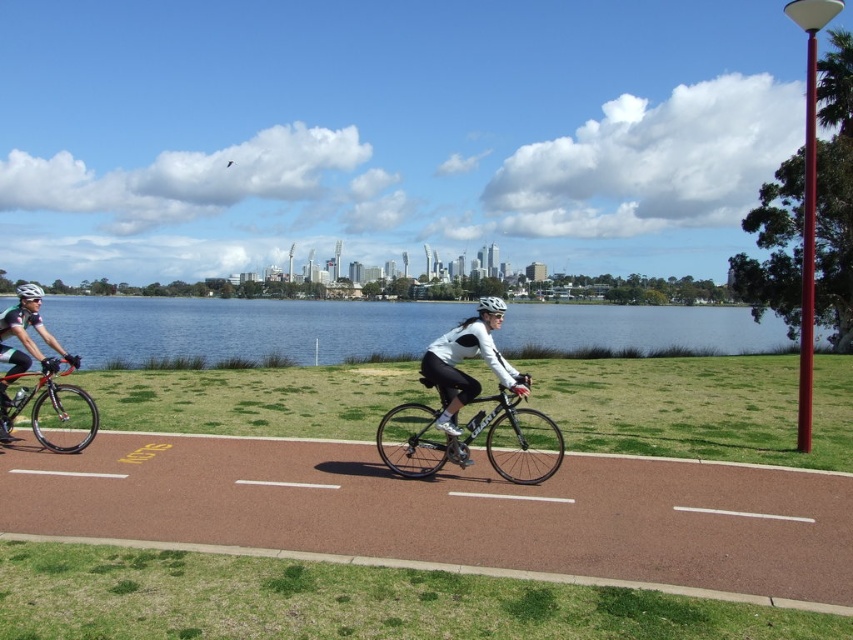
Question: Is blue water at center in front of shiny black bicycle at left?

Choices:
 (A) no
 (B) yes

Answer: (A)

Question: Among these objects, which one is nearest to the camera?

Choices:
 (A) white matte jacket at center
 (B) shiny black bicycle at left

Answer: (A)

Question: Does brown textured bike lane at center appear under shiny black bike at center?

Choices:
 (A) yes
 (B) no

Answer: (A)

Question: Estimate the real-world distances between objects in this image. Which object is closer to the shiny black bicycle at left?

Choices:
 (A) blue water at center
 (B) white matte bicycle helmet at left

Answer: (B)

Question: Is shiny black bike at center thinner than white matte bicycle helmet at left?

Choices:
 (A) no
 (B) yes

Answer: (B)

Question: Which of the following is the farthest from the observer?

Choices:
 (A) shiny black bike at center
 (B) white matte jacket at center
 (C) blue water at center
 (D) white matte bicycle helmet at left

Answer: (C)